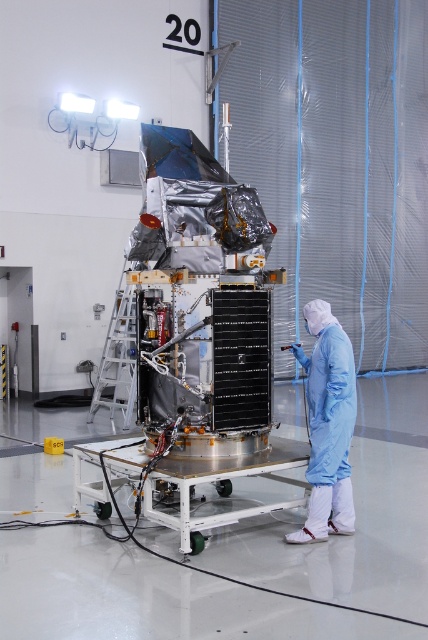
Who is more distant from viewer, (151, 321) or (288, 536)?

The point (151, 321) is more distant.

Can you confirm if silver reflective satellite at center is positioned above blue smooth suit at center?

Correct, silver reflective satellite at center is located above blue smooth suit at center.

Find the location of a particular element. This screenshot has width=428, height=640. silver reflective satellite at center is located at coordinates pos(202,310).